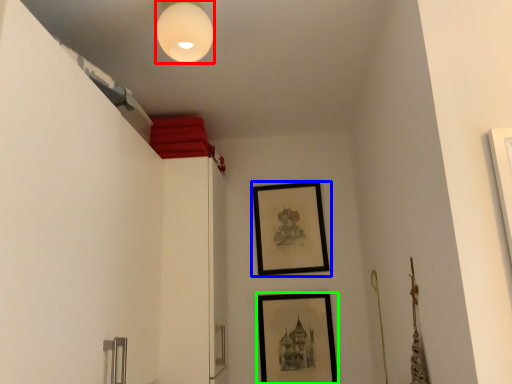
Question: Estimate the real-world distances between objects in this image. Which object is closer to light fixture (highlighted by a red box), picture frame (highlighted by a blue box) or picture frame (highlighted by a green box)?

Choices:
 (A) picture frame
 (B) picture frame

Answer: (A)